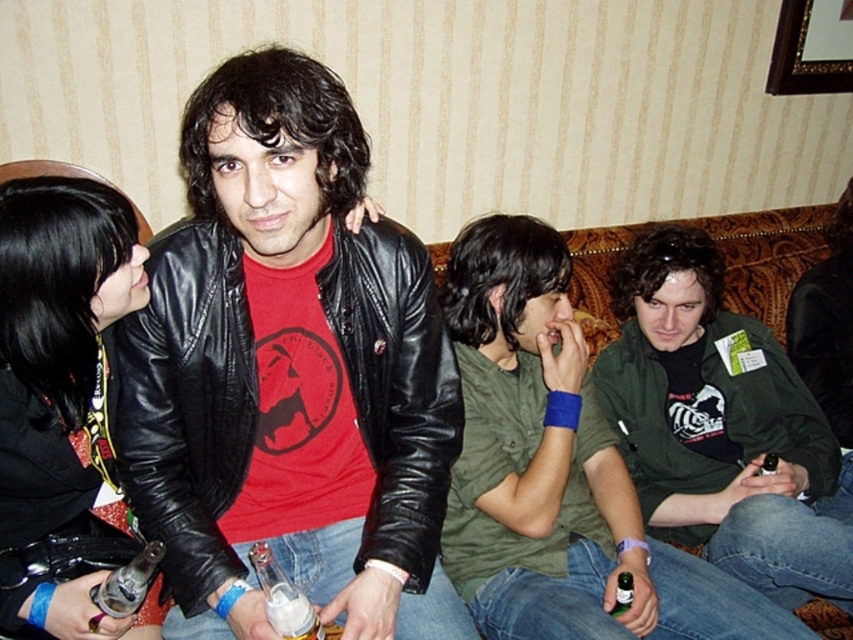
Question: Which point is farther from the camera taking this photo?

Choices:
 (A) (612, 609)
 (B) (494, 371)
 (C) (282, 600)
 (D) (292, 328)

Answer: (B)

Question: Can you confirm if green matte shirt at center is bigger than white frothy beer at lower left?

Choices:
 (A) no
 (B) yes

Answer: (B)

Question: Can you confirm if wooden picture frame at upper right is bigger than white frothy beer at lower left?

Choices:
 (A) no
 (B) yes

Answer: (B)

Question: Does matte black leather jacket at center appear on the left side of green glass bottle at lower center?

Choices:
 (A) yes
 (B) no

Answer: (A)

Question: Among these objects, which one is nearest to the camera?

Choices:
 (A) wooden picture frame at upper right
 (B) green matte shirt at center
 (C) green glass bottle at lower center

Answer: (B)

Question: Which object appears farthest from the camera in this image?

Choices:
 (A) green matte shirt at center
 (B) wooden picture frame at upper right
 (C) white frothy beer at lower left
 (D) green glass bottle at lower center

Answer: (B)